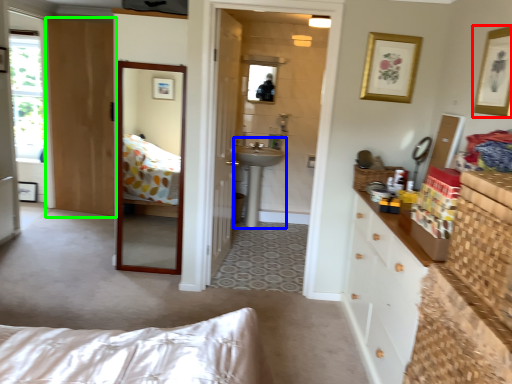
Question: Which object is the closest to the picture frame (highlighted by a red box)? Choose among these: sink (highlighted by a blue box) or door (highlighted by a green box).

Choices:
 (A) sink
 (B) door

Answer: (A)